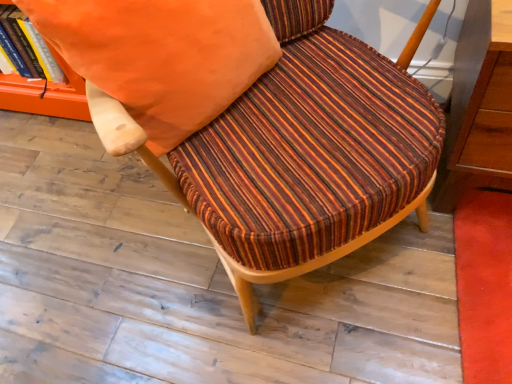
Question: Does striped fabric chair at center have a greater width compared to orange fabric pillow at upper center?

Choices:
 (A) yes
 (B) no

Answer: (A)

Question: Is striped fabric chair at center closer to camera compared to orange fabric pillow at upper center?

Choices:
 (A) yes
 (B) no

Answer: (A)

Question: Is the depth of striped fabric chair at center greater than that of orange fabric pillow at upper center?

Choices:
 (A) no
 (B) yes

Answer: (A)

Question: Is orange fabric pillow at upper center located within striped fabric chair at center?

Choices:
 (A) yes
 (B) no

Answer: (A)

Question: Does striped fabric chair at center have a smaller size compared to orange fabric pillow at upper center?

Choices:
 (A) yes
 (B) no

Answer: (B)

Question: Is striped fabric chair at center directly adjacent to orange fabric pillow at upper center?

Choices:
 (A) yes
 (B) no

Answer: (B)

Question: Does orange fabric book at upper left come behind orange fabric pillow at upper center?

Choices:
 (A) yes
 (B) no

Answer: (A)

Question: Is orange fabric book at upper left facing away from orange fabric pillow at upper center?

Choices:
 (A) no
 (B) yes

Answer: (A)

Question: Is orange fabric book at upper left facing towards orange fabric pillow at upper center?

Choices:
 (A) yes
 (B) no

Answer: (B)

Question: Can you confirm if orange fabric book at upper left is smaller than orange fabric pillow at upper center?

Choices:
 (A) no
 (B) yes

Answer: (B)

Question: Can you confirm if orange fabric book at upper left is positioned to the right of orange fabric pillow at upper center?

Choices:
 (A) no
 (B) yes

Answer: (A)

Question: Is orange fabric book at upper left touching orange fabric pillow at upper center?

Choices:
 (A) yes
 (B) no

Answer: (B)

Question: Is striped fabric chair at center closer to the viewer compared to orange fabric book at upper left?

Choices:
 (A) no
 (B) yes

Answer: (B)